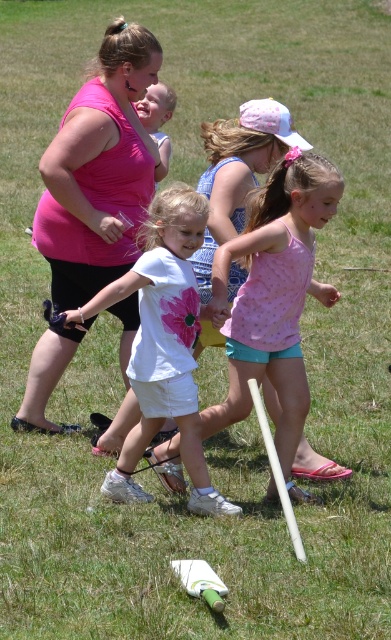
Question: Which of the following is the farthest from the observer?

Choices:
 (A) (278, 189)
 (B) (170, 276)
 (C) (154, 108)

Answer: (C)

Question: Which point appears farthest from the camera in this image?

Choices:
 (A) (251, 246)
 (B) (161, 90)
 (C) (100, 86)

Answer: (B)

Question: Is white matte shorts at center positioned at the back of pink matte shirt at center?

Choices:
 (A) yes
 (B) no

Answer: (B)

Question: Can you confirm if matte pink tank top at center is wider than white matte shorts at center?

Choices:
 (A) no
 (B) yes

Answer: (A)

Question: Is pink dotted tank top at center bigger than pink matte shirt at center?

Choices:
 (A) no
 (B) yes

Answer: (B)

Question: Which of the following is the closest to the observer?

Choices:
 (A) (25, 419)
 (B) (173, 209)
 (C) (163, 168)

Answer: (B)